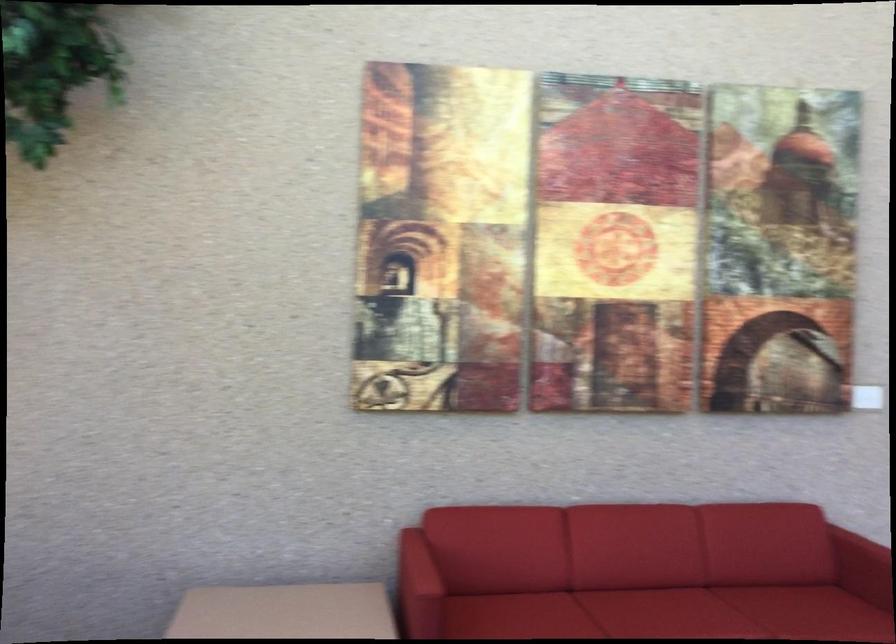
Locate an element on the screen. The image size is (896, 644). red sofa sitting surface is located at coordinates (659, 607).